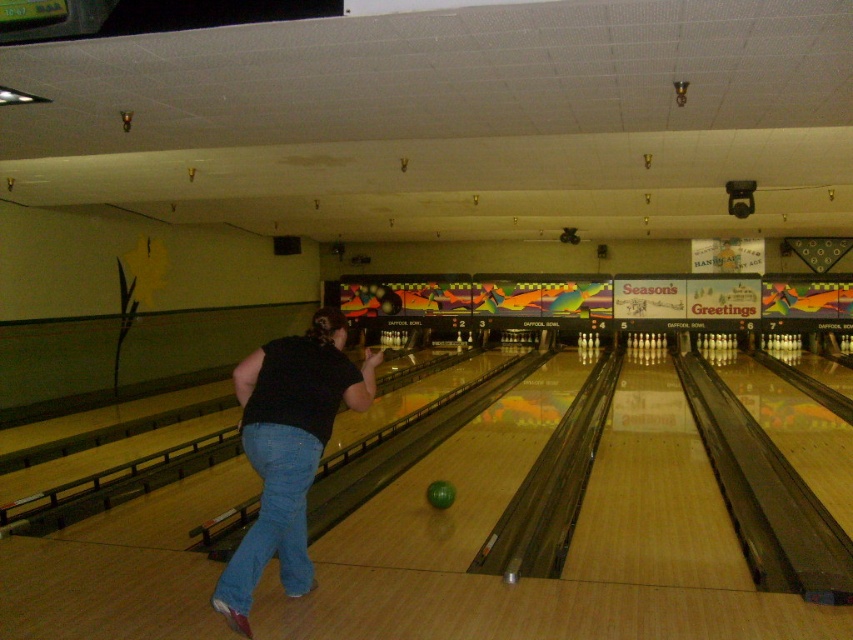
Between denim at left and green matte bowling ball at center, which one has less height?

green matte bowling ball at center is shorter.

Is denim at left positioned behind green matte bowling ball at center?

That is False.

Where is `denim at left`? This screenshot has width=853, height=640. denim at left is located at coordinates (271, 515).

Does black cotton shirt at center appear over green matte bowling ball at center?

Correct, black cotton shirt at center is located above green matte bowling ball at center.

Where is `black cotton shirt at center`? The image size is (853, 640). black cotton shirt at center is located at coordinates (288, 449).

This screenshot has height=640, width=853. Find the location of `black cotton shirt at center`. black cotton shirt at center is located at coordinates (288, 449).

Who is taller, black cotton shirt at center or denim at left?

With more height is black cotton shirt at center.

Who is shorter, black cotton shirt at center or denim at left?

denim at left is shorter.

What do you see at coordinates (288, 449) in the screenshot? The height and width of the screenshot is (640, 853). I see `black cotton shirt at center` at bounding box center [288, 449].

Image resolution: width=853 pixels, height=640 pixels. In order to click on black cotton shirt at center in this screenshot , I will do `click(288, 449)`.